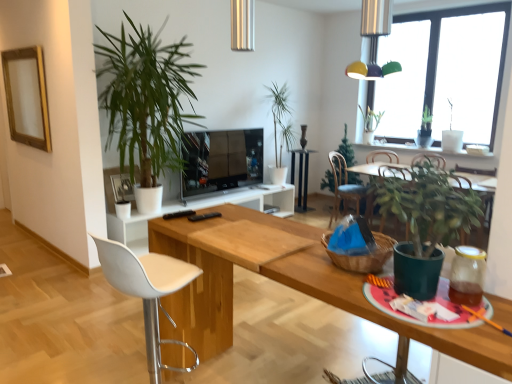
Identify the location of white leather chair at center, the first chair from the left. (148, 292).

The height and width of the screenshot is (384, 512). I want to click on brown woven basket at center, so click(362, 255).

In order to face blue fabric chair at center, the 2th chair viewed from the left, should I rotate leftwards or rightwards?

Rotate right and turn 12.569 degrees.

Identify the location of green leafy plant at left, the second houseplant viewed from the front. The height and width of the screenshot is (384, 512). (146, 99).

In the scene shown: What is the approximate height of flat screen tv at center?

30.05 inches.

Find the location of a particular element. This screenshot has height=384, width=512. white leather chair at center, positioned as the 1th chair in front-to-back order is located at coordinates (148, 292).

From the image's perspective, between green matte plant at center, the 4th houseplant when ordered from front to back, and green matte plant at right, which is the 3th houseplant from left to right, which one is located above?

green matte plant at center, the 4th houseplant when ordered from front to back, from the image's perspective.

From a real-world perspective, is green matte plant at center, the 2th houseplant when ordered from back to front, located beneath green matte plant at right, which is the 1th houseplant from front to back?

Yes.

Where is `houseplant below the green matte plant at center, which ranks as the second houseplant in right-to-left order (from the image's perspective)`? The image size is (512, 384). houseplant below the green matte plant at center, which ranks as the second houseplant in right-to-left order (from the image's perspective) is located at coordinates (425, 223).

Does green matte plant at center, which ranks as the second houseplant in right-to-left order, turn towards green matte plant at right, which is the 3th houseplant from left to right?

No, green matte plant at center, which ranks as the second houseplant in right-to-left order, is not turned towards green matte plant at right, which is the 3th houseplant from left to right.

Based on the photo, is the position of brown woven basket at center more distant than that of white leather chair at center, the first chair from the left?

No.

Does point (365, 267) appear closer or farther from the camera than point (105, 244)?

Point (365, 267) appears to be closer to the viewer than point (105, 244).

From a real-world perspective, does brown woven basket at center stand above white leather chair at center, which appears as the second chair when viewed from the right?

Yes.

Considering the relative sizes of brown woven basket at center and white leather chair at center, which appears as the second chair when viewed from the right, in the image provided, is brown woven basket at center wider than white leather chair at center, which appears as the second chair when viewed from the right,?

No.

Does point (236, 185) lie in front of point (202, 263)?

No, it is behind (202, 263).

Is flat screen tv at center far from wooden table at center?

Yes.

Is flat screen tv at center wider or thinner than wooden table at center?

flat screen tv at center is thinner than wooden table at center.

Is flat screen tv at center positioned in front of wooden table at center?

No, the depth of flat screen tv at center is greater than that of wooden table at center.

Is wooden table at center shorter than white leather chair at center, the second chair viewed from the back?

Yes, wooden table at center is shorter than white leather chair at center, the second chair viewed from the back.

Does wooden table at center have a greater width compared to white leather chair at center, the first chair from the left?

Indeed, wooden table at center has a greater width compared to white leather chair at center, the first chair from the left.

Would you say wooden table at center is a long distance from white leather chair at center, the first chair from the left?

That's not correct — wooden table at center is a little close to white leather chair at center, the first chair from the left.

From a real-world perspective, is wooden table at center physically located above or below white leather chair at center, the first chair from the left?

wooden table at center is below white leather chair at center, the first chair from the left.

From the image's perspective, is black glossy side table at center above blue fabric chair at center, placed as the 1th chair when sorted from back to front?

Yes, from the image's perspective, black glossy side table at center is over blue fabric chair at center, placed as the 1th chair when sorted from back to front.

Is black glossy side table at center with blue fabric chair at center, placed as the 1th chair when sorted from back to front?

black glossy side table at center is not next to blue fabric chair at center, placed as the 1th chair when sorted from back to front, and they're not touching.

Is black glossy side table at center located outside blue fabric chair at center, placed as the 1th chair when sorted from back to front?

Yes, black glossy side table at center is not within blue fabric chair at center, placed as the 1th chair when sorted from back to front.

Does black glossy side table at center turn towards blue fabric chair at center, which is counted as the 1th chair, starting from the right?

Yes.

Who is taller, green matte plant at center, the 2th houseplant when ordered from back to front, or transparent glass window at upper right?

Standing taller between the two is transparent glass window at upper right.

How many degrees apart are the facing directions of green matte plant at center, which ranks as the second houseplant in right-to-left order, and transparent glass window at upper right?

They differ by 0.412 degrees in their facing directions.

The height and width of the screenshot is (384, 512). In order to click on window located above the green matte plant at center, placed as the 4th houseplant when sorted from left to right (from a real-world perspective) in this screenshot , I will do click(434, 71).

Is green matte plant at center, placed as the 4th houseplant when sorted from left to right, closer to the viewer compared to transparent glass window at upper right?

No, the depth of green matte plant at center, placed as the 4th houseplant when sorted from left to right, is greater than that of transparent glass window at upper right.

Is green matte plant at right, which is the fifth houseplant in back-to-front order, smaller than blue fabric chair at center, placed as the 1th chair when sorted from back to front?

Indeed, green matte plant at right, which is the fifth houseplant in back-to-front order, has a smaller size compared to blue fabric chair at center, placed as the 1th chair when sorted from back to front.

Is point (447, 226) closer or farther from the camera than point (356, 202)?

Point (447, 226) appears to be closer to the viewer than point (356, 202).

Could you tell me if green matte plant at right, which is the third houseplant from right to left, is facing blue fabric chair at center, which is counted as the 1th chair, starting from the right?

No, green matte plant at right, which is the third houseplant from right to left, is not oriented towards blue fabric chair at center, which is counted as the 1th chair, starting from the right.

Considering the relative positions of green matte plant at right, which is the 1th houseplant from front to back, and blue fabric chair at center, which is the 2th chair from front to back, in the image provided, is green matte plant at right, which is the 1th houseplant from front to back, to the right of blue fabric chair at center, which is the 2th chair from front to back, from the viewer's perspective?

No, green matte plant at right, which is the 1th houseplant from front to back, is not to the right of blue fabric chair at center, which is the 2th chair from front to back.

Find the location of a particular element. houseplant below the green matte plant at center, placed as the 4th houseplant when sorted from left to right (from the image's perspective) is located at coordinates (425, 223).

Locate an element on the screen. basket lying in front of the white leather chair at center, the second chair viewed from the back is located at coordinates (362, 255).

Which object lies further to the anchor point brown woven basket at center, transparent glass window at upper right or black glossy side table at center?

black glossy side table at center.

Considering their positions, is multicolored plastic light fixture at upper right positioned further to black glossy side table at center than green leafy plant at left, the first houseplant when ordered from left to right?

green leafy plant at left, the first houseplant when ordered from left to right, is positioned further to the anchor black glossy side table at center.

From the image, which object appears to be nearer to flat screen tv at center, transparent glass window at upper right or green leafy plant at left, the second houseplant viewed from the front?

Among the two, green leafy plant at left, the second houseplant viewed from the front, is located nearer to flat screen tv at center.

When comparing their distances from green matte plant at upper right, arranged as the 1th houseplant when viewed from the right, does green leafy plant at left, acting as the fourth houseplant starting from the back, or blue fabric chair at center, the 2th chair viewed from the left, seem closer?

blue fabric chair at center, the 2th chair viewed from the left, lies closer to green matte plant at upper right, arranged as the 1th houseplant when viewed from the right, than the other object.

Estimate the real-world distances between objects in this image. Which object is closer to green leafy plant at center, which is the third houseplant in back-to-front order, green matte plant at center, the 2th houseplant when ordered from back to front, or green matte plant at upper right, the first houseplant positioned from the back?

Among the two, green matte plant at center, the 2th houseplant when ordered from back to front, is located nearer to green leafy plant at center, which is the third houseplant in back-to-front order.

Based on their spatial positions, is multicolored plastic light fixture at upper right or green matte plant at right, which is the 1th houseplant from front to back, further from green matte plant at upper right, the first houseplant positioned from the back?

green matte plant at right, which is the 1th houseplant from front to back.

From the picture: Estimate the real-world distances between objects in this image. Which object is closer to white leather chair at center, which appears as the second chair when viewed from the right, green leafy plant at center, the 3th houseplant when ordered from front to back, or blue fabric chair at center, placed as the 1th chair when sorted from back to front?

blue fabric chair at center, placed as the 1th chair when sorted from back to front, is positioned closer to the anchor white leather chair at center, which appears as the second chair when viewed from the right.

Based on the photo, when comparing their distances from white leather chair at center, which appears as the second chair when viewed from the right, does green leafy plant at left, the second houseplant viewed from the front, or multicolored plastic light fixture at upper right seem closer?

green leafy plant at left, the second houseplant viewed from the front, lies closer to white leather chair at center, which appears as the second chair when viewed from the right, than the other object.

Locate an element on the screen. Image resolution: width=512 pixels, height=384 pixels. houseplant between white leather chair at center, positioned as the 1th chair in front-to-back order, and blue fabric chair at center, which is counted as the 1th chair, starting from the right, from front to back is located at coordinates (146, 99).

This screenshot has height=384, width=512. I want to click on basket between wooden table at center and transparent glass window at upper right in the front-back direction, so click(x=362, y=255).

The width and height of the screenshot is (512, 384). Identify the location of chair between green leafy plant at center, the 4th houseplant from the right, and green matte plant at upper right, which is counted as the fifth houseplant, starting from the left, from left to right. (343, 187).

Image resolution: width=512 pixels, height=384 pixels. In order to click on light fixture between green matte plant at right, which is the 3th houseplant from left to right, and transparent glass window at upper right from front to back in this screenshot , I will do `click(374, 40)`.